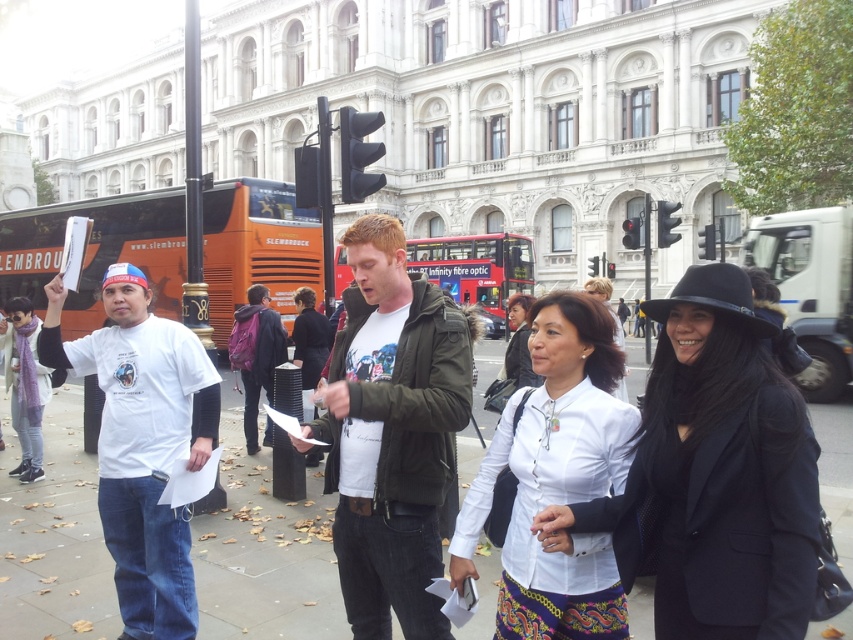
Is point (788, 557) in front of point (35, 600)?

Yes, point (788, 557) is in front of point (35, 600).

Can you confirm if black matte hat at center is thinner than brown concrete pavement at lower center?

Correct, black matte hat at center's width is less than brown concrete pavement at lower center's.

Image resolution: width=853 pixels, height=640 pixels. I want to click on black matte hat at center, so click(x=714, y=474).

What are the coordinates of `black matte hat at center` in the screenshot? It's located at (714, 474).

Which is above, white matte shirt at center or red double-decker bus at center?

red double-decker bus at center is higher up.

Is point (627, 438) closer to camera compared to point (456, 296)?

Yes, point (627, 438) is in front of point (456, 296).

Where is `white matte shirt at center`? This screenshot has height=640, width=853. white matte shirt at center is located at coordinates (556, 480).

Can you confirm if brown concrete pavement at lower center is positioned above white t-shirt at left?

Incorrect, brown concrete pavement at lower center is not positioned above white t-shirt at left.

Does point (633, 390) come farther from viewer compared to point (56, 337)?

Yes, point (633, 390) is behind point (56, 337).

Locate an element on the screen. The height and width of the screenshot is (640, 853). brown concrete pavement at lower center is located at coordinates (263, 554).

Locate an element on the screen. brown concrete pavement at lower center is located at coordinates (263, 554).